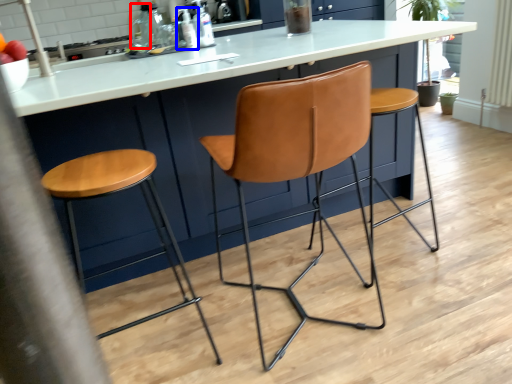
Question: Among these objects, which one is farthest to the camera, bottle (highlighted by a red box) or bottle (highlighted by a blue box)?

Choices:
 (A) bottle
 (B) bottle

Answer: (A)